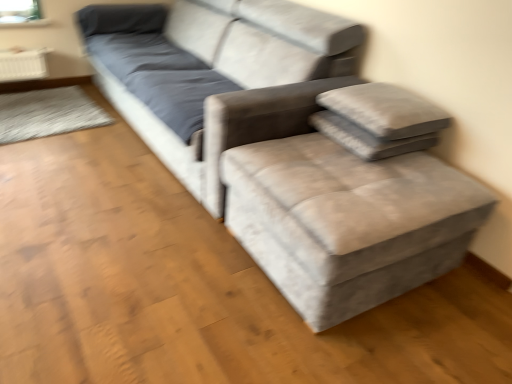
Question: Is velvet grey couch at center in front of gray fabric pillow at upper right, which appears as the first pillow when ordered from the bottom?

Choices:
 (A) no
 (B) yes

Answer: (B)

Question: From a real-world perspective, is velvet grey couch at center located beneath gray fabric pillow at upper right, which is counted as the 2th pillow, starting from the top?

Choices:
 (A) no
 (B) yes

Answer: (B)

Question: Is velvet grey couch at center facing away from gray fabric pillow at upper right, which is counted as the 2th pillow, starting from the top?

Choices:
 (A) no
 (B) yes

Answer: (A)

Question: Can you confirm if velvet grey couch at center is bigger than gray fabric pillow at upper right, which appears as the first pillow when ordered from the bottom?

Choices:
 (A) yes
 (B) no

Answer: (A)

Question: Does velvet grey couch at center have a greater height compared to gray fabric pillow at upper right, which is counted as the 2th pillow, starting from the top?

Choices:
 (A) yes
 (B) no

Answer: (A)

Question: From a real-world perspective, is velvet grey couch at center on gray fabric pillow at upper right, which appears as the first pillow when ordered from the bottom?

Choices:
 (A) no
 (B) yes

Answer: (A)

Question: Is velvet grey couch at center wider than textured gray couch at center?

Choices:
 (A) yes
 (B) no

Answer: (B)

Question: Does velvet grey couch at center have a lesser height compared to textured gray couch at center?

Choices:
 (A) yes
 (B) no

Answer: (B)

Question: Can you confirm if velvet grey couch at center is thinner than textured gray couch at center?

Choices:
 (A) no
 (B) yes

Answer: (B)

Question: Is velvet grey couch at center smaller than textured gray couch at center?

Choices:
 (A) no
 (B) yes

Answer: (A)

Question: From the image's perspective, is velvet grey couch at center above textured gray couch at center?

Choices:
 (A) no
 (B) yes

Answer: (B)

Question: Is velvet grey couch at center closer to the viewer compared to textured gray couch at center?

Choices:
 (A) no
 (B) yes

Answer: (A)

Question: Does gray fabric pillow at upper right, which appears as the first pillow when ordered from the bottom, come in front of textured gray pillow at upper right, which ranks as the first pillow in top-to-bottom order?

Choices:
 (A) yes
 (B) no

Answer: (B)